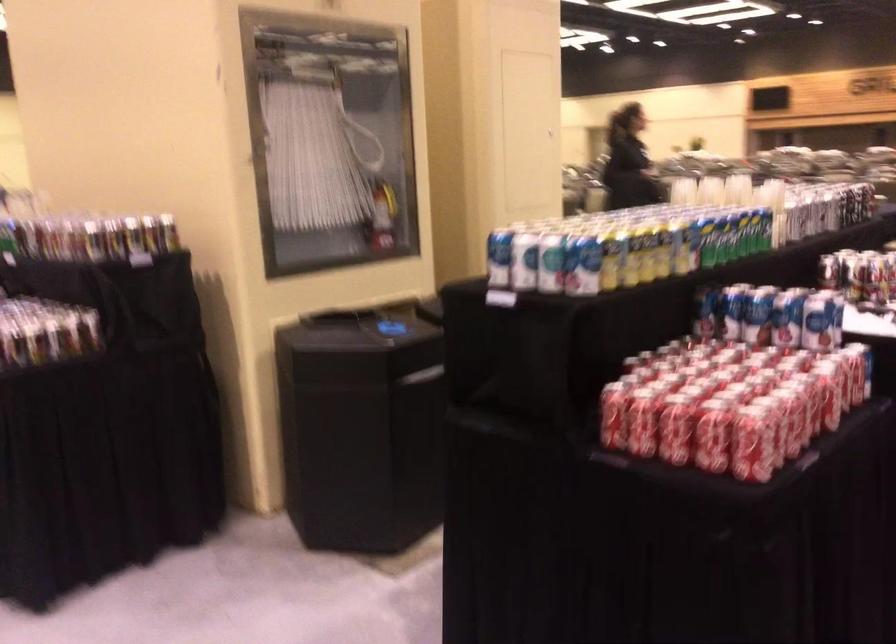
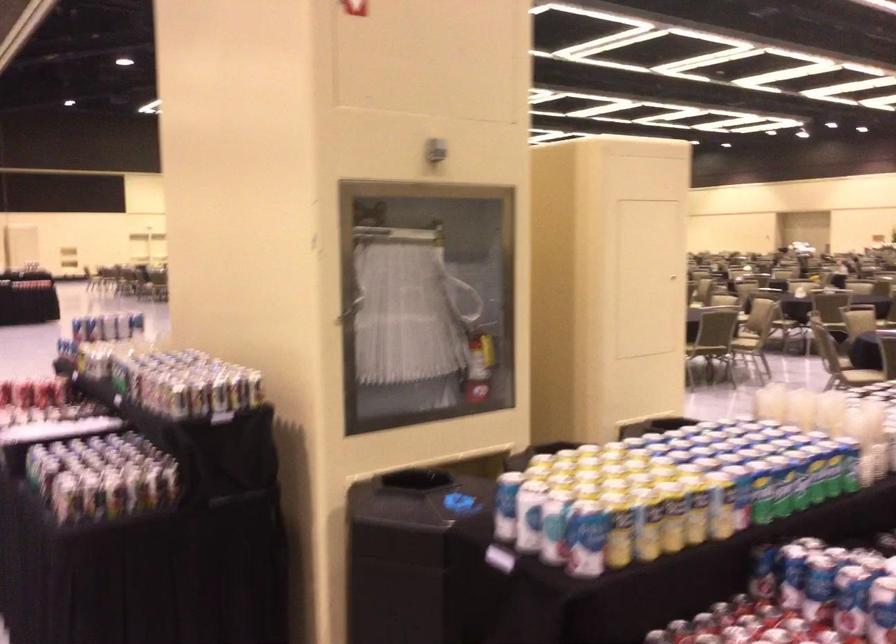
Question: What movement of the cameraman would produce the second image?

Choices:
 (A) Left
 (B) Right
 (C) Forward
 (D) Backward

Answer: (B)